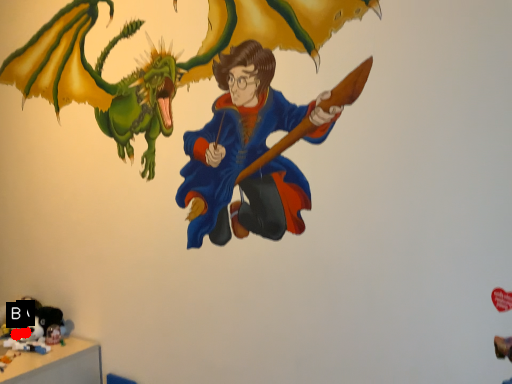
Question: Two points are circled on the image, labeled by A and B beside each circle. Which of the following is the closest to the observer?

Choices:
 (A) A is closer
 (B) B is closer

Answer: (B)